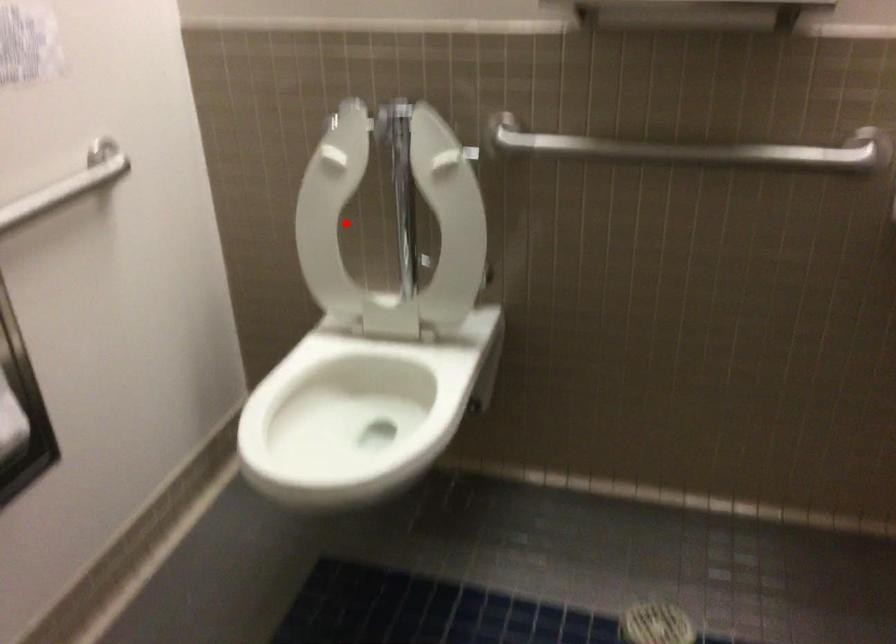
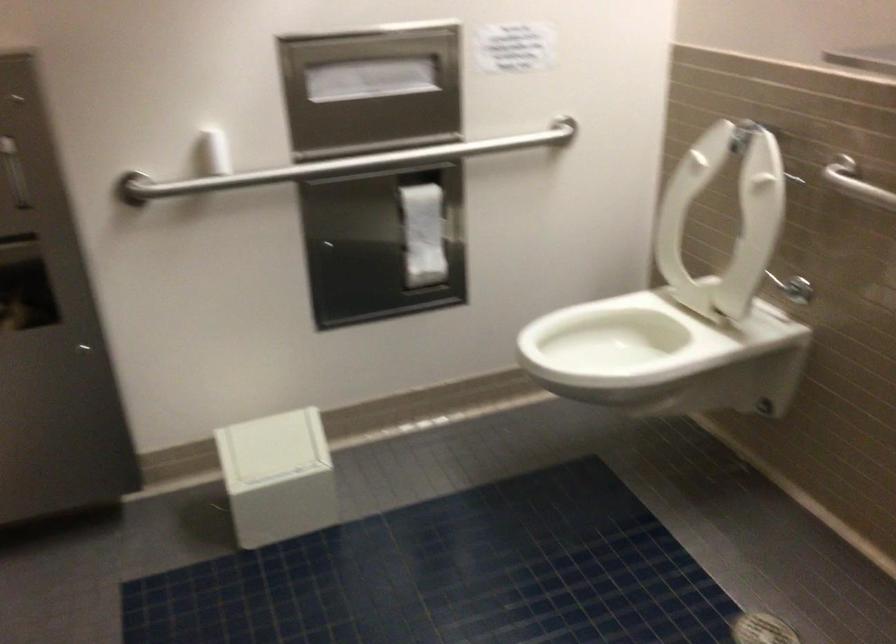
Question: I am providing you with two images of the same scene from different viewpoints. A red point is shown in image1. For the corresponding object point in image2, is it positioned nearer or farther from the camera?

Choices:
 (A) Nearer
 (B) Farther

Answer: (B)